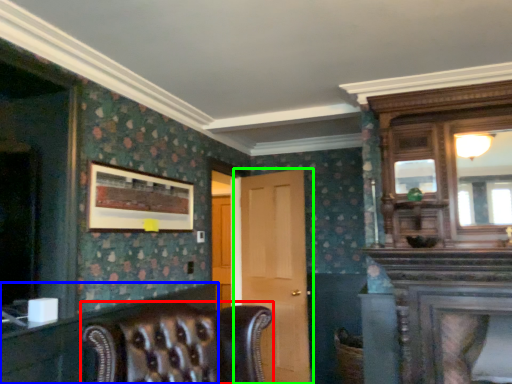
Question: Which object is the closest to the chair (highlighted by a red box)? Choose among these: dresser (highlighted by a blue box) or door (highlighted by a green box).

Choices:
 (A) dresser
 (B) door

Answer: (A)